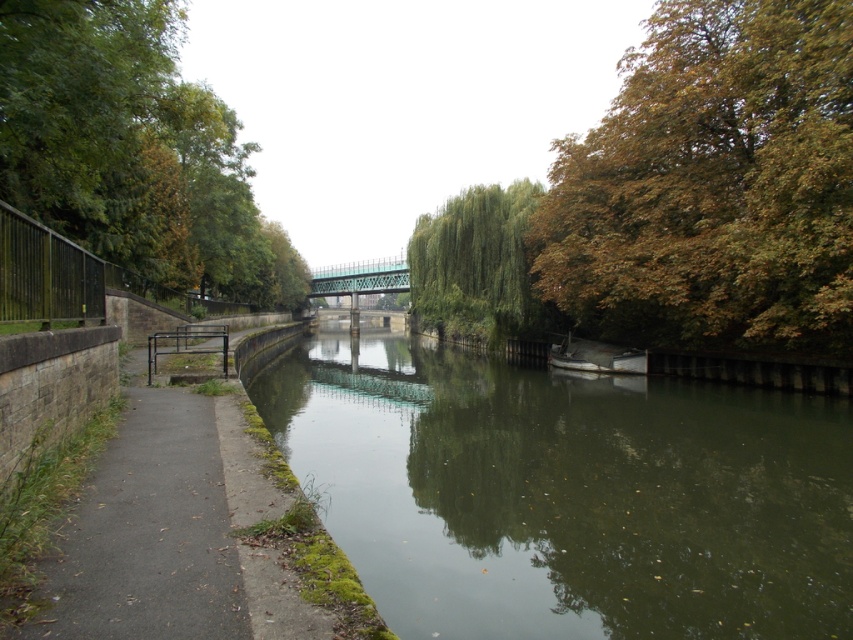
Question: Where is green leafy tree at center located in relation to white matte boat at center in the image?

Choices:
 (A) above
 (B) below

Answer: (A)

Question: Estimate the real-world distances between objects in this image. Which object is farther from the greenish-brown concrete river at center?

Choices:
 (A) brown leafy tree at upper right
 (B) white matte boat at center

Answer: (A)

Question: Among these points, which one is farthest from the camera?

Choices:
 (A) (74, 64)
 (B) (421, 316)
 (C) (810, 177)

Answer: (B)

Question: Can you confirm if brown leafy tree at upper right is positioned to the right of white matte boat at center?

Choices:
 (A) no
 (B) yes

Answer: (B)

Question: Considering the relative positions of brown leafy tree at upper right and stone paved path at left in the image provided, where is brown leafy tree at upper right located with respect to stone paved path at left?

Choices:
 (A) below
 (B) above

Answer: (B)

Question: Which object is farther from the camera taking this photo?

Choices:
 (A) green leafy tree at center
 (B) green metallic bridge at center

Answer: (B)